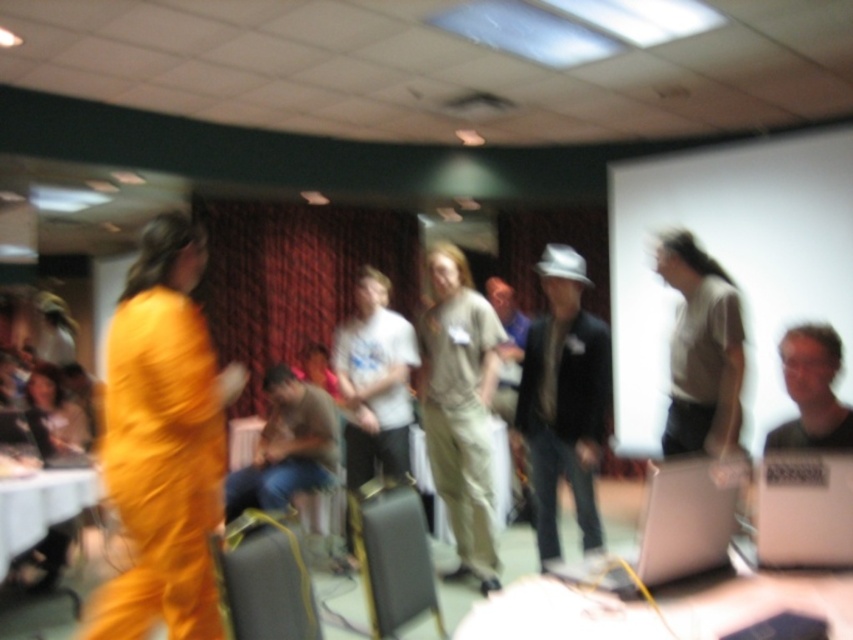
You are organizing a photo shoot and need to position two models wearing the matte black suit at center and beige cotton shirt at center. The minimum required distance between them for proper lighting is 16 inches. Based on the scene description, can they maintain the required distance while staying at their current positions?

The matte black suit at center is 16.01 inches from the beige cotton shirt at center, which is just over the 16 inch minimum requirement. They can maintain the required distance while staying at their current positions.

Consider the image. You are an event photographer at the conference. You need to capture a photo where both the matte black suit at center and the beige cotton shirt at center are clearly visible. Given their height difference, which one might you adjust your camera angle to focus on first?

The matte black suit at center is shorter than the beige cotton shirt at center. To ensure both are visible, you should first focus on the matte black suit at center and then adjust the angle upwards to include the taller beige cotton shirt at center.